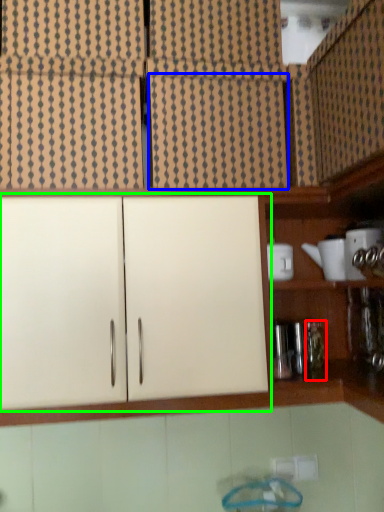
Question: Based on their relative distances, which object is nearer to bottle (highlighted by a red box)? Choose from cabinetry (highlighted by a blue box) and cabinetry (highlighted by a green box).

Choices:
 (A) cabinetry
 (B) cabinetry

Answer: (B)